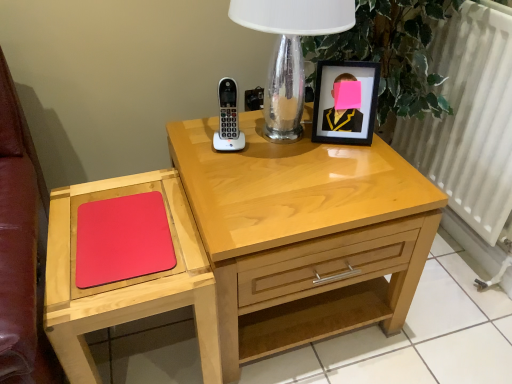
Question: From a real-world perspective, is matte wood mouse pad at left located higher than white plastic phone at center?

Choices:
 (A) yes
 (B) no

Answer: (B)

Question: From a real-world perspective, does matte wood mouse pad at left sit lower than white plastic phone at center?

Choices:
 (A) yes
 (B) no

Answer: (A)

Question: Considering the relative sizes of matte wood mouse pad at left and white plastic phone at center in the image provided, is matte wood mouse pad at left smaller than white plastic phone at center?

Choices:
 (A) yes
 (B) no

Answer: (B)

Question: Is matte wood mouse pad at left bigger than white plastic phone at center?

Choices:
 (A) no
 (B) yes

Answer: (B)

Question: Are matte wood mouse pad at left and white plastic phone at center far apart?

Choices:
 (A) no
 (B) yes

Answer: (A)

Question: Considering the positions of clear glass table lamp at upper center and white metallic radiator at right in the image, is clear glass table lamp at upper center bigger or smaller than white metallic radiator at right?

Choices:
 (A) small
 (B) big

Answer: (A)

Question: From a real-world perspective, relative to white metallic radiator at right, is clear glass table lamp at upper center vertically above or below?

Choices:
 (A) above
 (B) below

Answer: (A)

Question: In the image, is clear glass table lamp at upper center on the left side or the right side of white metallic radiator at right?

Choices:
 (A) right
 (B) left

Answer: (B)

Question: Does point (312, 11) appear closer or farther from the camera than point (451, 127)?

Choices:
 (A) closer
 (B) farther

Answer: (A)

Question: In the image, is light wood nightstand at center positioned in front of or behind white metallic radiator at right?

Choices:
 (A) front
 (B) behind

Answer: (A)

Question: In the image, is light wood nightstand at center on the left side or the right side of white metallic radiator at right?

Choices:
 (A) right
 (B) left

Answer: (B)

Question: Looking at the image, does light wood nightstand at center seem bigger or smaller compared to white metallic radiator at right?

Choices:
 (A) big
 (B) small

Answer: (A)

Question: Is light wood nightstand at center inside or outside of white metallic radiator at right?

Choices:
 (A) inside
 (B) outside

Answer: (B)

Question: Considering the positions of rubberized matte red mousepad at left and matte wood mouse pad at left in the image, is rubberized matte red mousepad at left taller or shorter than matte wood mouse pad at left?

Choices:
 (A) tall
 (B) short

Answer: (B)

Question: In the image, is rubberized matte red mousepad at left positioned in front of or behind matte wood mouse pad at left?

Choices:
 (A) behind
 (B) front

Answer: (A)